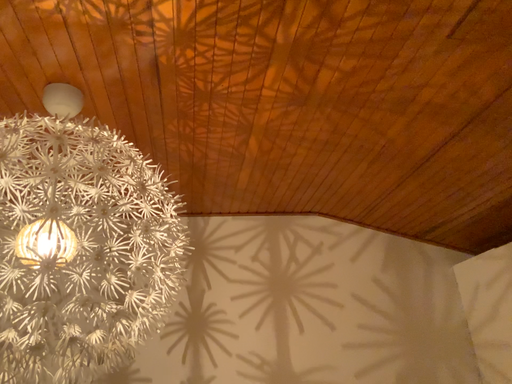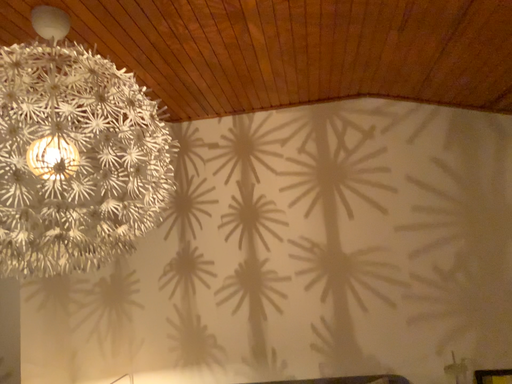
Question: How did the camera likely rotate when shooting the video?

Choices:
 (A) rotated right
 (B) rotated left

Answer: (B)